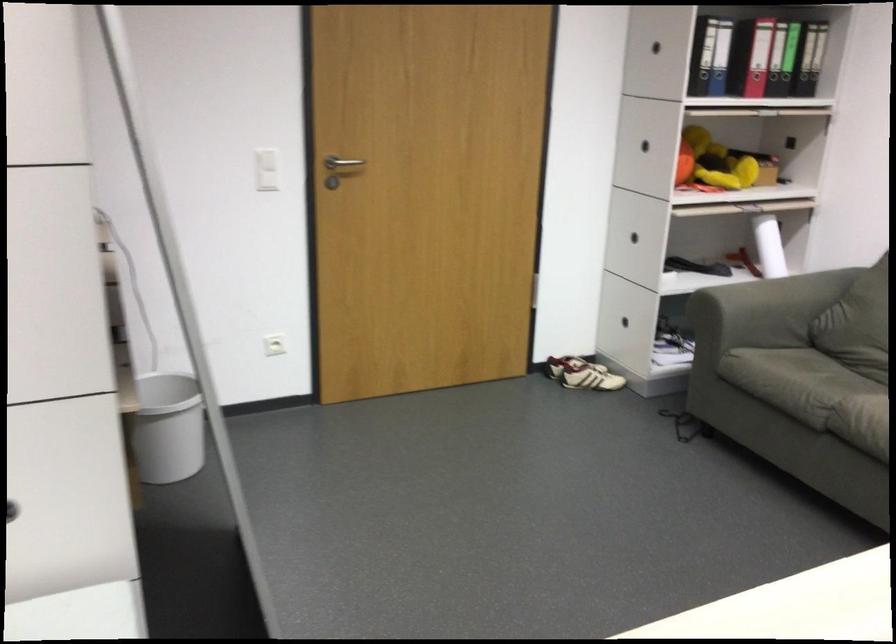
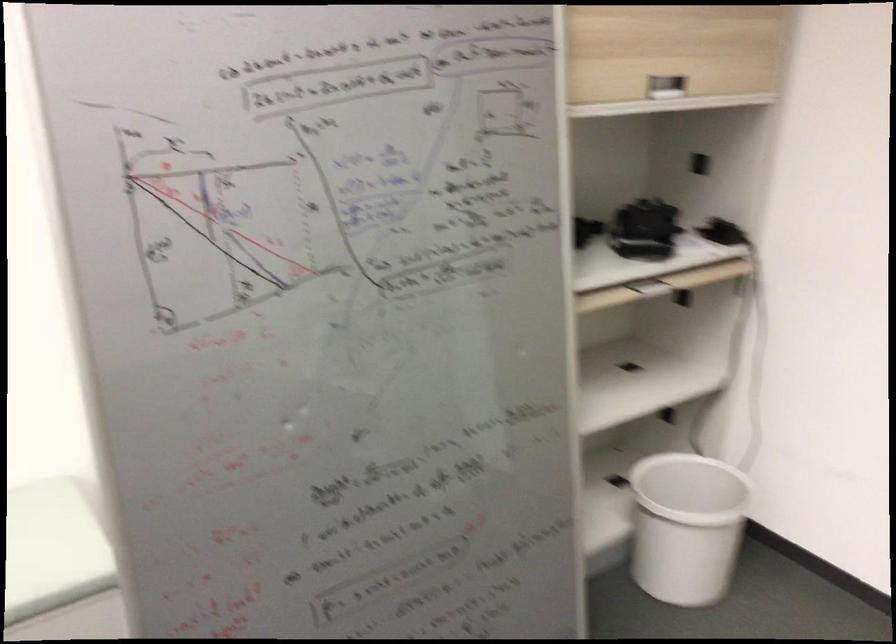
Where in the second image is the point corresponding to the point at 142,420 from the first image?

(686, 526)